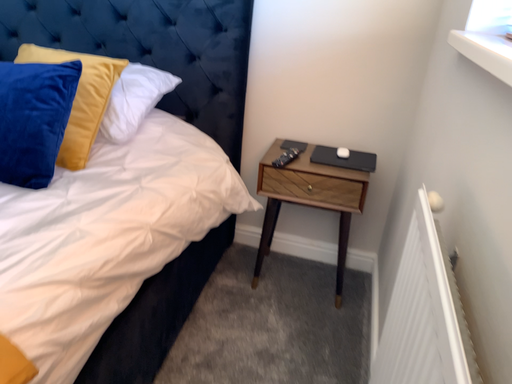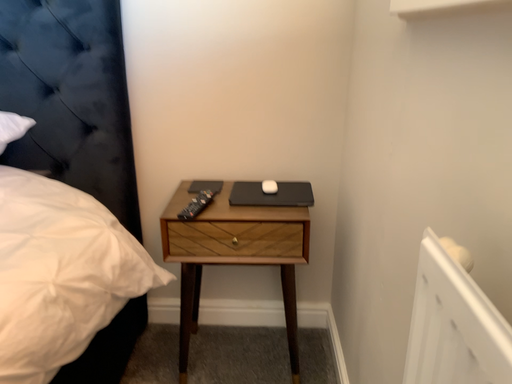
Question: How did the camera likely rotate when shooting the video?

Choices:
 (A) rotated right
 (B) rotated left

Answer: (A)